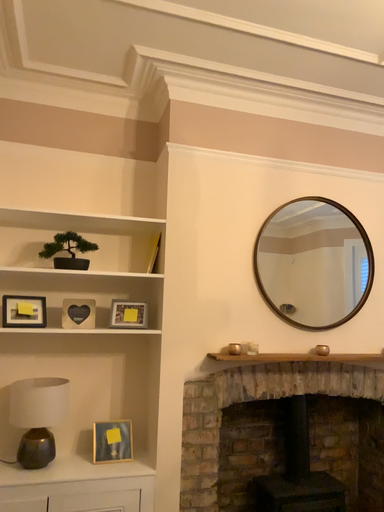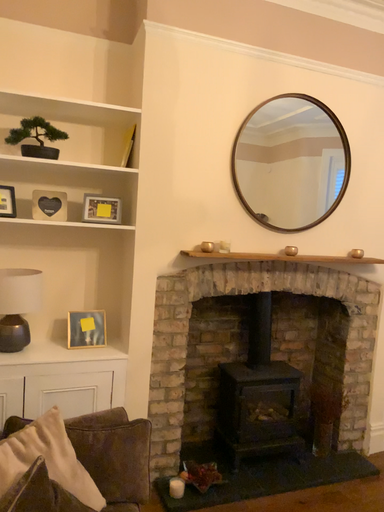
Question: Which way did the camera rotate in the video?

Choices:
 (A) rotated downward
 (B) rotated upward

Answer: (A)